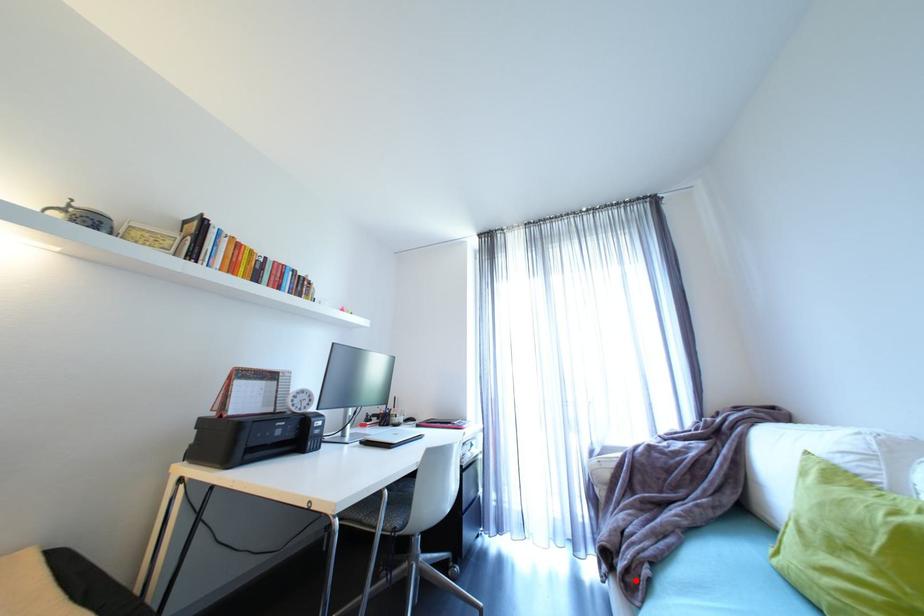
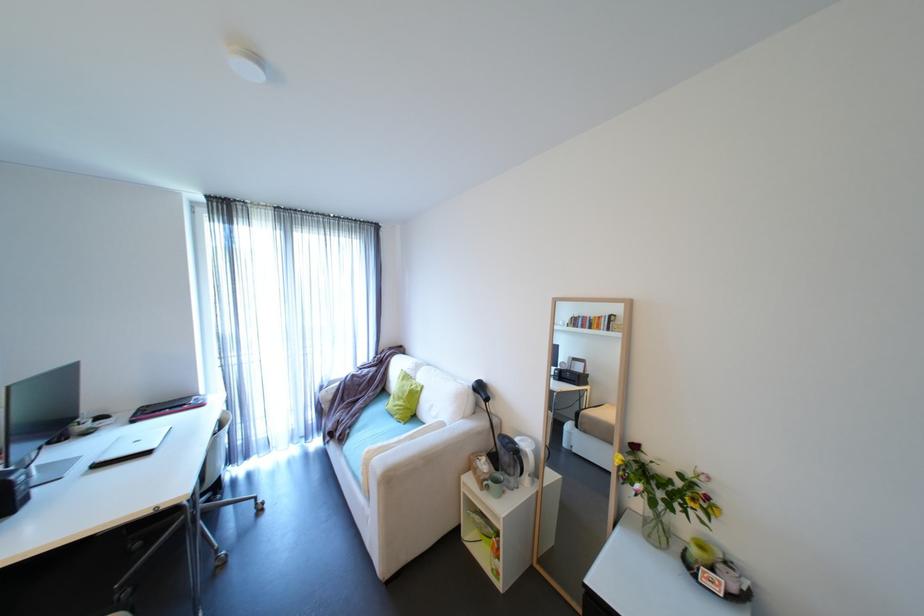
Question: A red point is marked in image1. In image2, is the corresponding 3D point closer to the camera or farther? Reply with the corresponding letter.

Choices:
 (A) The corresponding 3D point is closer.
 (B) The corresponding 3D point is farther.

Answer: (B)